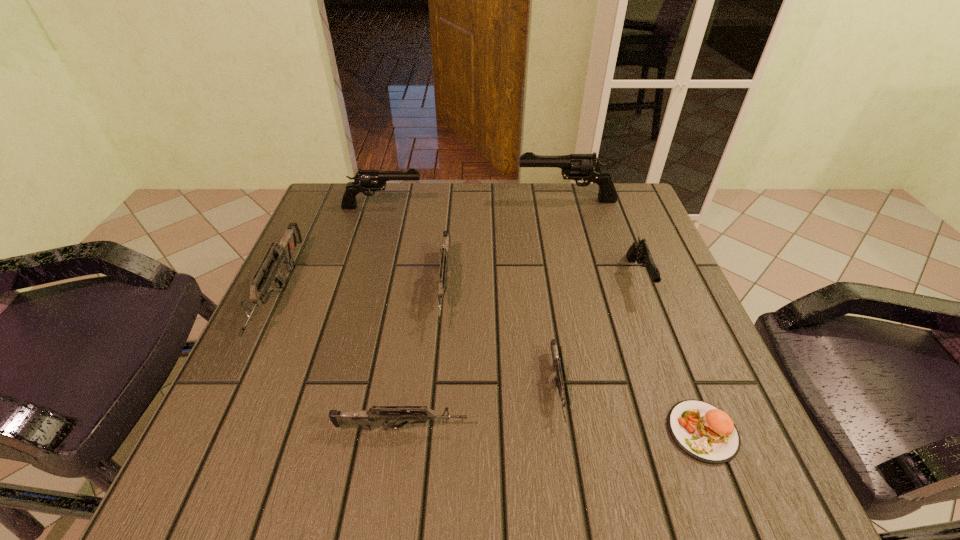
Identify which grey gun is located as the third nearest to the second smallest grey gun. Please provide its 2D coordinates. Your answer should be formatted as a tuple, i.e. [(x, y)], where the tuple contains the x and y coordinates of a point satisfying the conditions above.

[(282, 252)]

Locate which grey gun is the closest to the patty. Please provide its 2D coordinates. Your answer should be formatted as a tuple, i.e. [(x, y)], where the tuple contains the x and y coordinates of a point satisfying the conditions above.

[(559, 383)]

Locate an element on the screen. The image size is (960, 540). vacant point that satisfies the following two spatial constraints: 1. on the back side of the patty; 2. at the end of the barrel of the leftmost black gun is located at coordinates (614, 207).

Identify the location of vacant area that satisfies the following two spatial constraints: 1. at the end of the barrel of the tallest object; 2. aimed along the barrel of the second shortest object. (614, 388).

At what (x,y) coordinates should I click in order to perform the action: click on vacant space that satisfies the following two spatial constraints: 1. aimed along the barrel of the second biggest grey gun; 2. on the right side of the patty. Please return your answer as a coordinate pair (x, y). The height and width of the screenshot is (540, 960). Looking at the image, I should click on (433, 431).

In order to click on vacant space that satisfies the following two spatial constraints: 1. aimed along the barrel of the second biggest grey gun; 2. on the left side of the shortest object in this screenshot , I will do `click(433, 431)`.

Where is `free space that satisfies the following two spatial constraints: 1. at the end of the barrel of the biggest black gun; 2. aimed along the barrel of the leftmost grey gun`? free space that satisfies the following two spatial constraints: 1. at the end of the barrel of the biggest black gun; 2. aimed along the barrel of the leftmost grey gun is located at coordinates (590, 294).

You are a GUI agent. You are given a task and a screenshot of the screen. Output one action in this format:
    pyautogui.click(x=<x>, y=<y>)
    Task: Click on the vacant space that satisfies the following two spatial constraints: 1. at the end of the barrel of the leftmost black gun; 2. aimed along the barrel of the leftmost object
    This screenshot has width=960, height=540.
    Given the screenshot: What is the action you would take?
    pyautogui.click(x=358, y=294)

The width and height of the screenshot is (960, 540). In order to click on blank space that satisfies the following two spatial constraints: 1. at the end of the barrel of the smallest black gun; 2. aimed along the barrel of the third shortest object in this screenshot , I will do `click(696, 428)`.

Find the location of `blank space that satisfies the following two spatial constraints: 1. at the end of the barrel of the leftmost black gun; 2. aimed along the barrel of the leftmost grey gun`. blank space that satisfies the following two spatial constraints: 1. at the end of the barrel of the leftmost black gun; 2. aimed along the barrel of the leftmost grey gun is located at coordinates (358, 294).